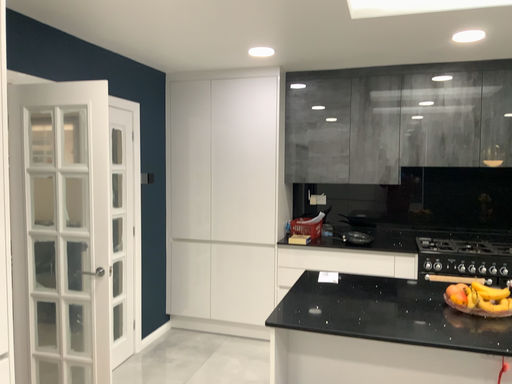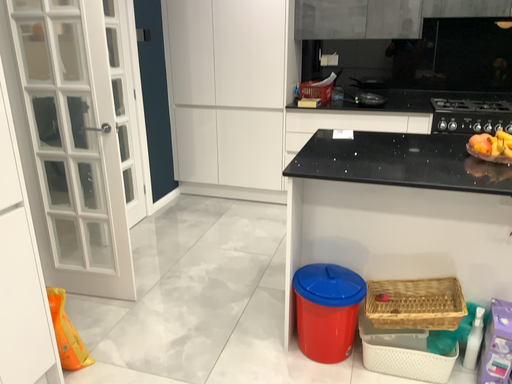
Question: Which way did the camera rotate in the video?

Choices:
 (A) rotated downward
 (B) rotated upward

Answer: (A)